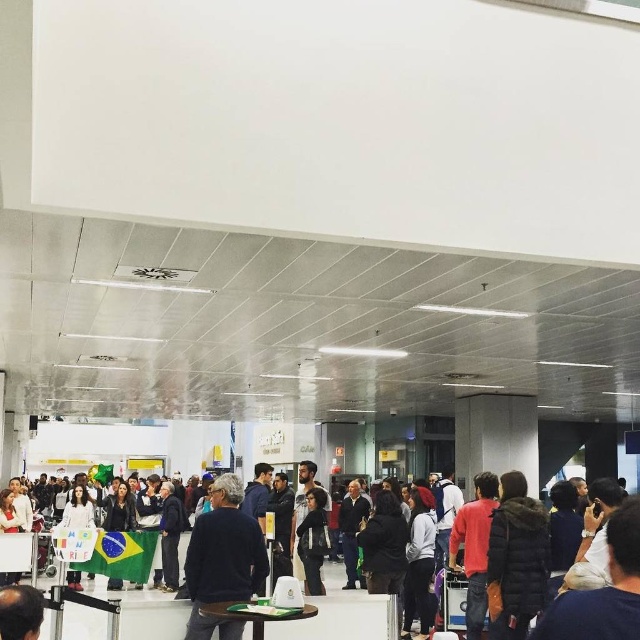
You are a photographer trying to capture both the dark blue sweater at center and the dark brown fur coat at center in a single shot without moving your camera. Since you want to ensure both are fully visible, which clothing item might you need to adjust your focus on to account for its height?

The dark brown fur coat at center is taller than the dark blue sweater at center, so you should focus on the dark brown fur coat at center to ensure the entire height of both items is captured.

You are an airport security officer who needs to quickly identify the shorter jacket between the dark blue jacket at center and the black leather jacket at center. Which one should you point to?

The dark blue jacket at center is not as tall as the black leather jacket at center, so the dark blue jacket at center is the shorter one.